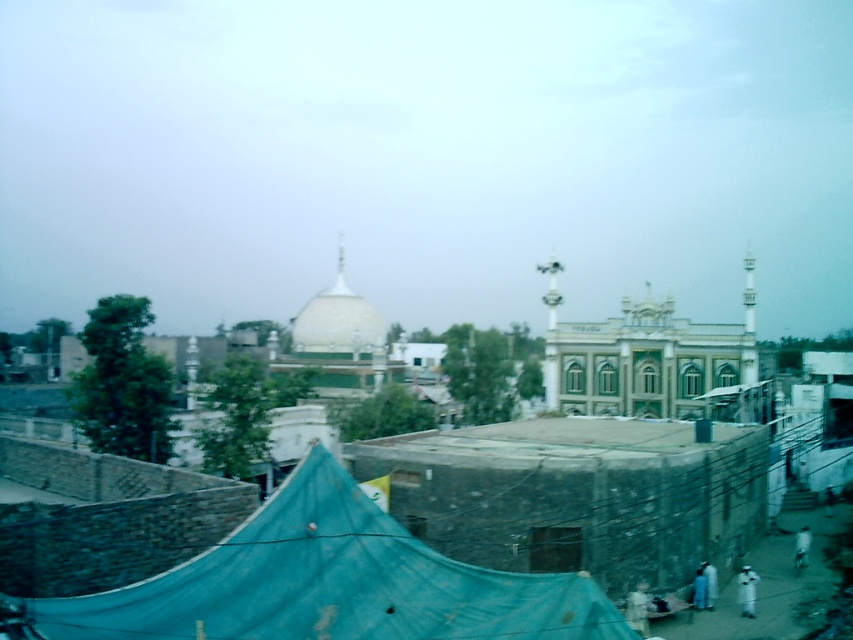
You are standing in the urban landscape scene. There are two points marked in the image, one at coordinates point (351, 556) and another at point (358, 344). Which of these points is nearer to your current position?

Point (351, 556) is closer to the camera than point (358, 344), so the point at coordinates point (351, 556) is nearer to your current position.

You are standing in the urban landscape and want to place a small potted plant between the blue tarpaulin at center and the white glossy dome at center. Based on their positions, which object should the plant be closer to?

The blue tarpaulin at center is to the right of the white glossy dome at center, so the plant should be placed closer to the white glossy dome at center to be between them.